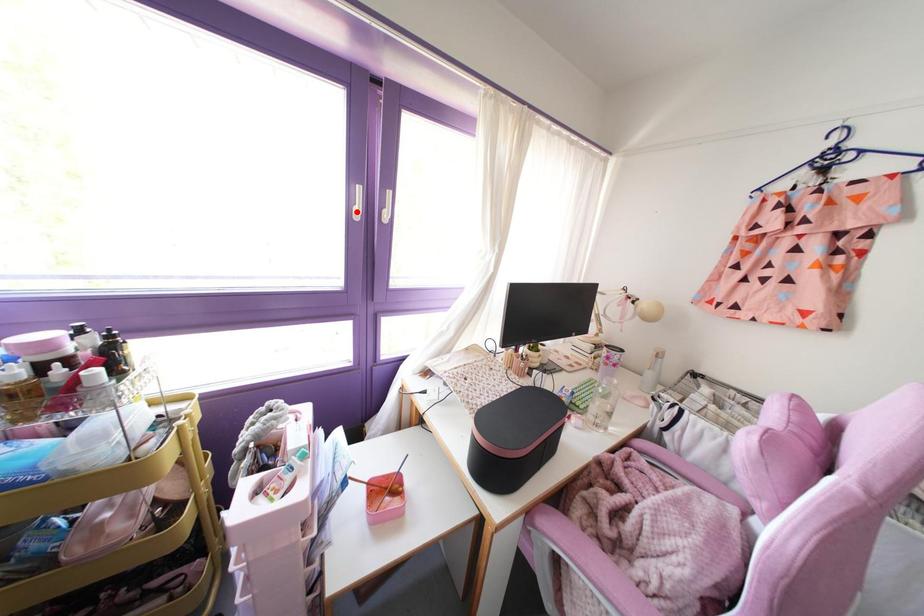
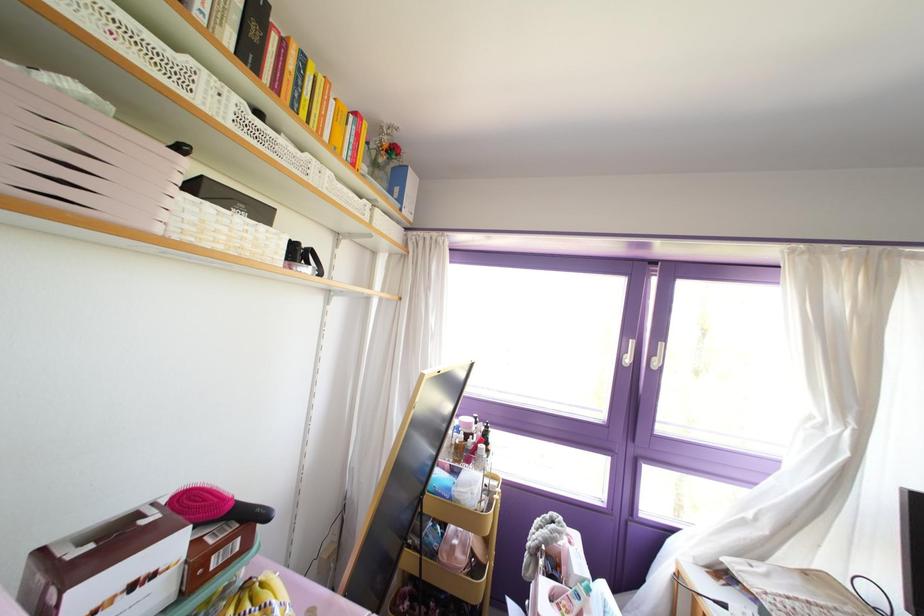
Locate, in the second image, the point that corresponds to the highlighted location in the first image.

(626, 360)